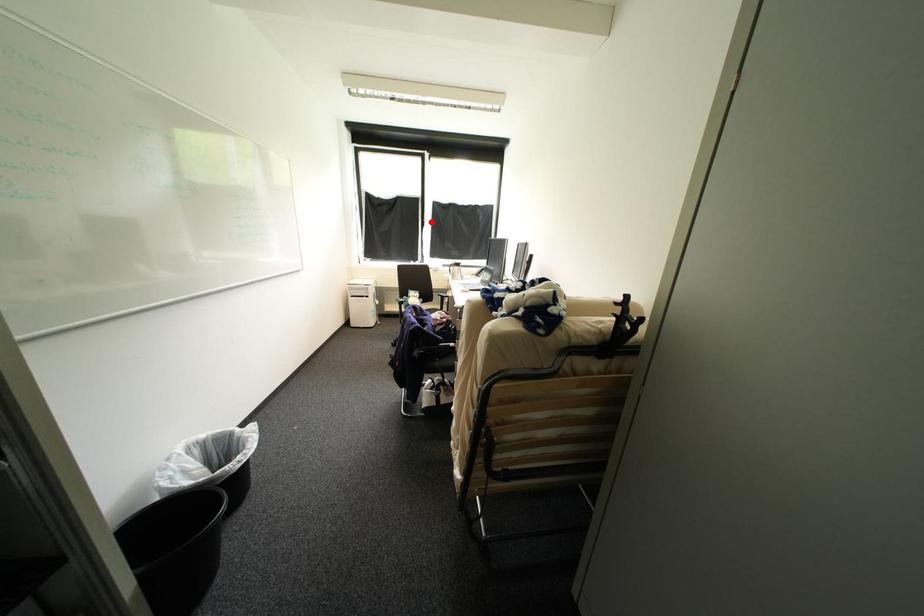
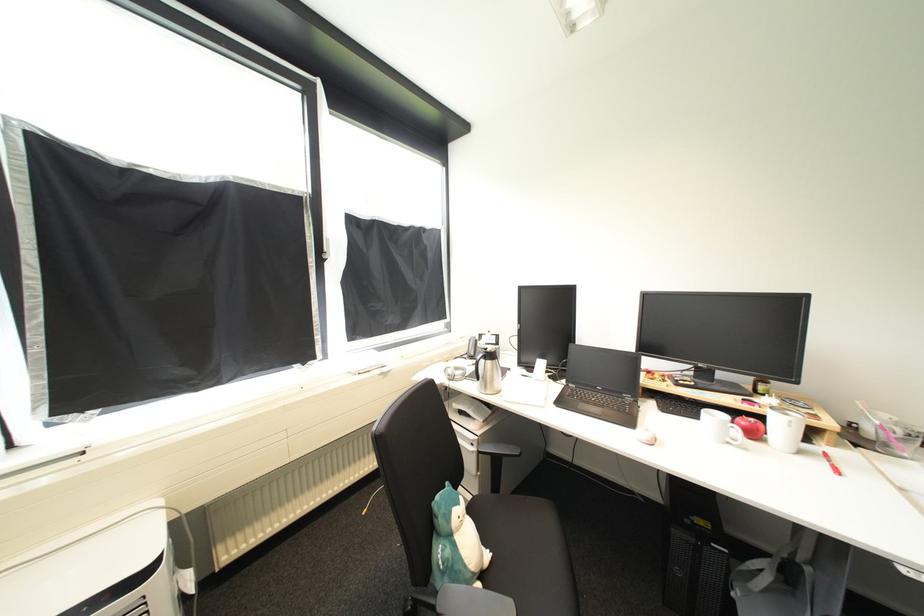
Where in the second image is the point corresponding to the highlighted location from the first image?

(331, 257)